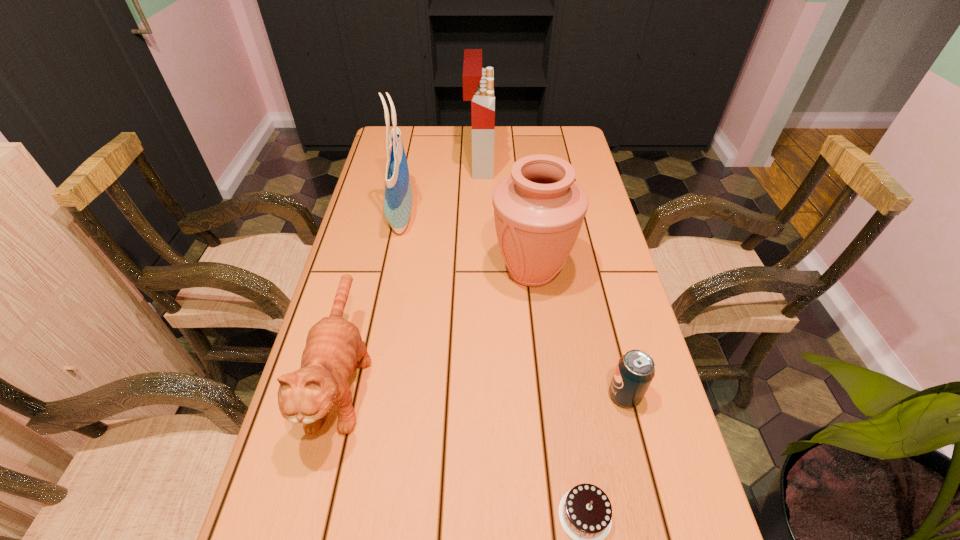
Where is `free location that satisfies the following two spatial constraints: 1. with the lid open on the cigarette case; 2. on the face of the cat`? This screenshot has width=960, height=540. free location that satisfies the following two spatial constraints: 1. with the lid open on the cigarette case; 2. on the face of the cat is located at coordinates (479, 376).

Locate an element on the screen. The width and height of the screenshot is (960, 540). free point that satisfies the following two spatial constraints: 1. on the front side of the tote bag; 2. on the right side of the soda can is located at coordinates (365, 395).

Identify the location of vacant region that satisfies the following two spatial constraints: 1. with the lid open on the farthest object; 2. on the face of the cat. (479, 376).

Where is `free space in the image that satisfies the following two spatial constraints: 1. with the lid open on the cigarette case; 2. on the face of the third shortest object`? The image size is (960, 540). free space in the image that satisfies the following two spatial constraints: 1. with the lid open on the cigarette case; 2. on the face of the third shortest object is located at coordinates (479, 376).

Where is `free location that satisfies the following two spatial constraints: 1. with the lid open on the cigarette case; 2. on the face of the cat`? This screenshot has width=960, height=540. free location that satisfies the following two spatial constraints: 1. with the lid open on the cigarette case; 2. on the face of the cat is located at coordinates (479, 376).